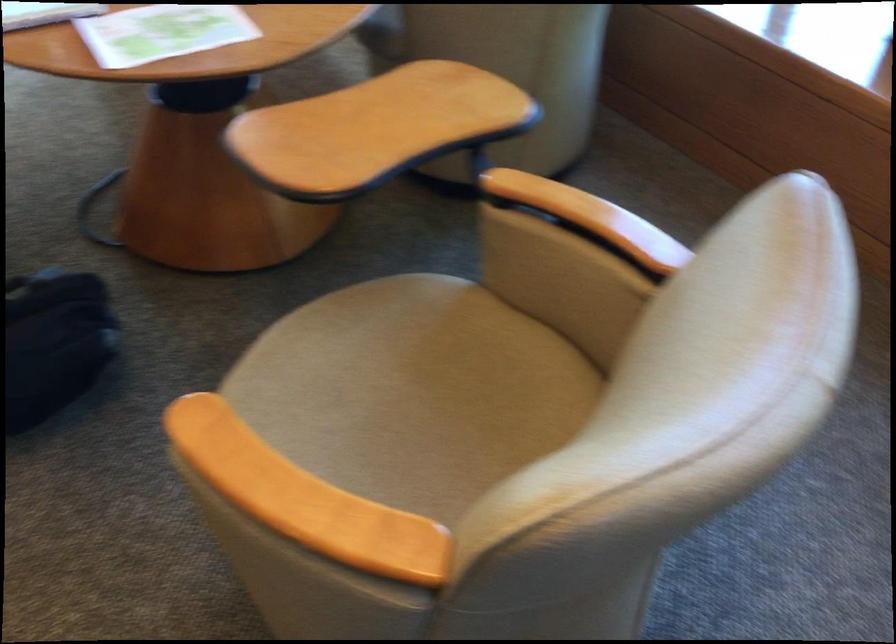
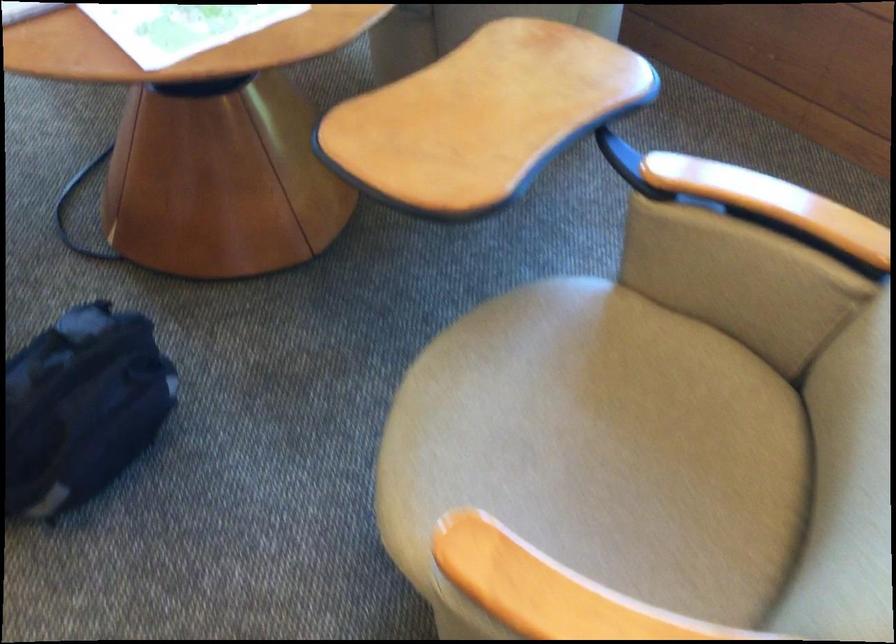
What movement of the cameraman would produce the second image?

The movement direction of the cameraman is left, forward.